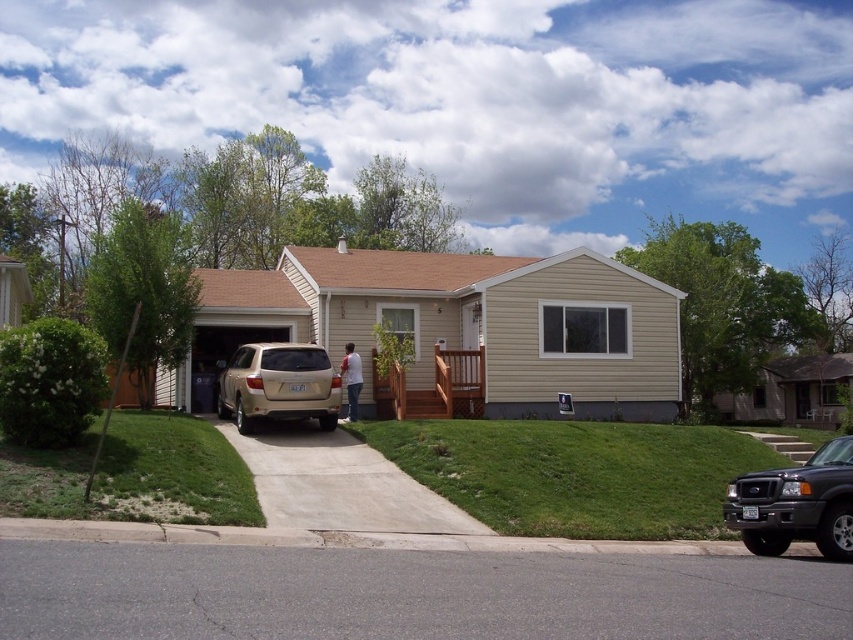
Does concrete at center have a lesser width compared to gold metallic suv at center?

Yes, concrete at center is thinner than gold metallic suv at center.

Is point (376, 481) in front of point (228, 384)?

Yes.

Find the location of `concrete at center`. concrete at center is located at coordinates (339, 484).

Between concrete at center and shiny black suv at lower right, which one appears on the right side from the viewer's perspective?

shiny black suv at lower right is more to the right.

Looking at this image, is concrete at center to the right of shiny black suv at lower right from the viewer's perspective?

In fact, concrete at center is to the left of shiny black suv at lower right.

Between point (416, 509) and point (792, 508), which one is positioned behind?

The point (416, 509) is more distant.

At what (x,y) coordinates should I click in order to perform the action: click on concrete at center. Please return your answer as a coordinate pair (x, y). Looking at the image, I should click on (339, 484).

Looking at this image, is asphalt at lower center thinner than shiny black suv at lower right?

Incorrect, asphalt at lower center's width is not less than shiny black suv at lower right's.

Can you confirm if asphalt at lower center is bigger than shiny black suv at lower right?

Yes.

Who is more distant from viewer, (630,604) or (795,516)?

Positioned behind is point (795,516).

Locate an element on the screen. asphalt at lower center is located at coordinates (409, 595).